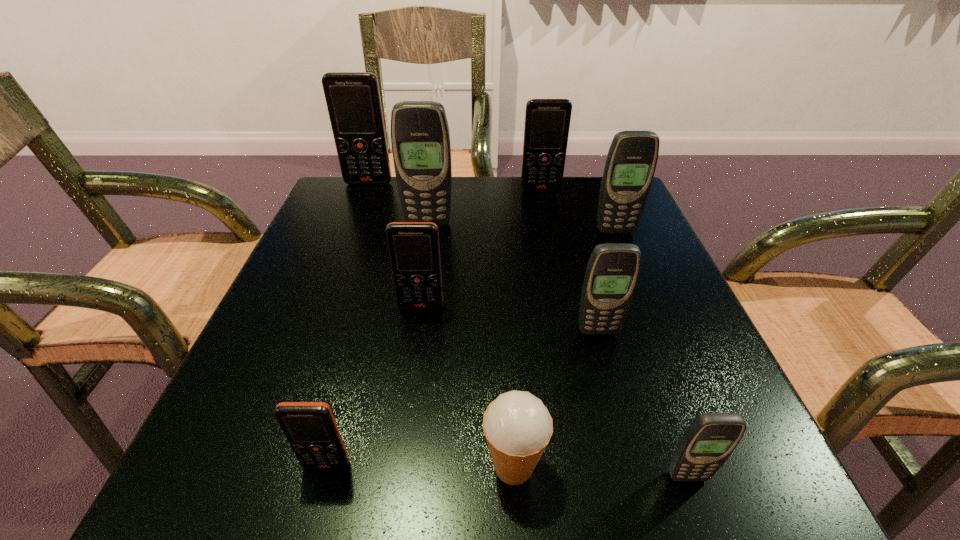
Identify the location of the fourth nearest cellular telephone. The image size is (960, 540). (414, 252).

Identify the location of the second orange cellular telephone from right to left. (414, 252).

This screenshot has height=540, width=960. Identify the location of the nearest orange cellular telephone. (310, 427).

Where is `the smallest gray cellular telephone`? The image size is (960, 540). the smallest gray cellular telephone is located at coordinates (710, 439).

Where is `the fifth object from right to left`? Image resolution: width=960 pixels, height=540 pixels. the fifth object from right to left is located at coordinates (517, 426).

At what (x,y) coordinates should I click in order to perform the action: click on vacant space located 0.190m on the screen of the farthest orange cellular telephone. Please return your answer as a coordinate pair (x, y). The image size is (960, 540). Looking at the image, I should click on (351, 229).

Identify the location of vacant space located 0.060m on the screen of the farthest gray cellular telephone. Image resolution: width=960 pixels, height=540 pixels. (425, 244).

The width and height of the screenshot is (960, 540). What are the coordinates of `vacant space positioned 0.080m on the screen of the third smallest orange cellular telephone` in the screenshot? It's located at (545, 210).

You are a GUI agent. You are given a task and a screenshot of the screen. Output one action in this format:
    pyautogui.click(x=<x>, y=<y>)
    Task: Click on the vacant area situated 0.120m on the screen of the third nearest gray cellular telephone
    
    Given the screenshot: What is the action you would take?
    pyautogui.click(x=631, y=269)

You are a GUI agent. You are given a task and a screenshot of the screen. Output one action in this format:
    pyautogui.click(x=<x>, y=<y>)
    Task: Click on the free space located 0.190m on the screen of the third nearest cellular telephone
    The height and width of the screenshot is (540, 960).
    Given the screenshot: What is the action you would take?
    pyautogui.click(x=627, y=442)